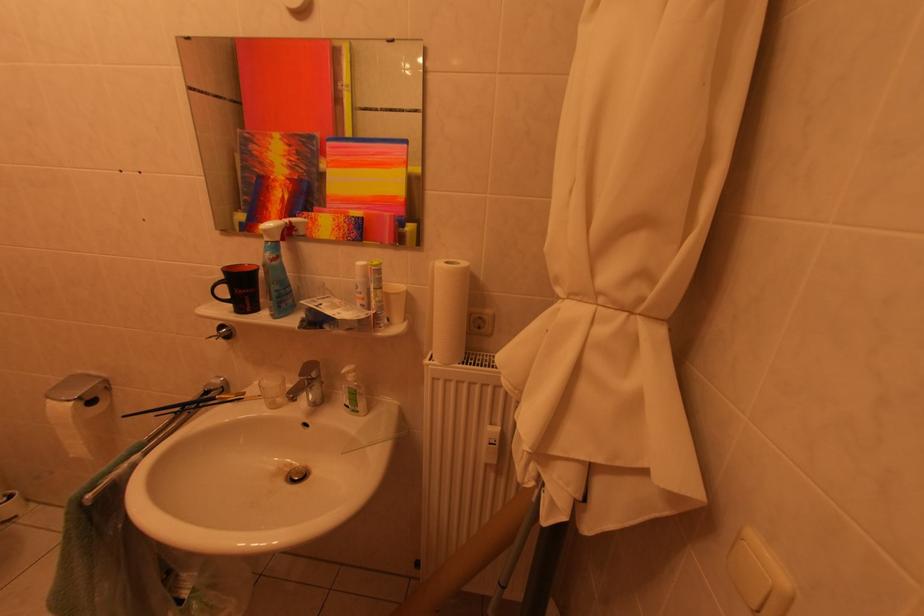
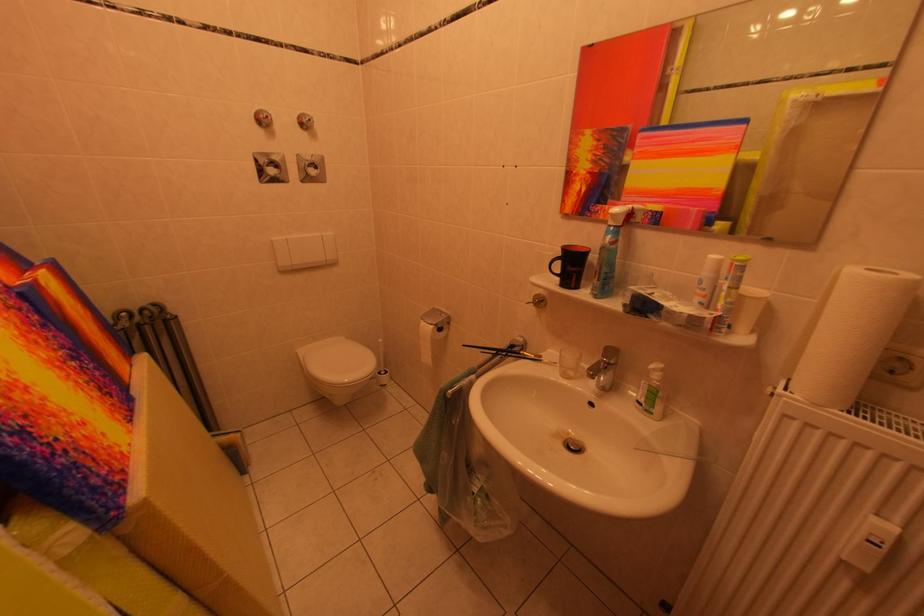
Find the pixel in the second image that matches [266,272] in the first image.

(599, 253)